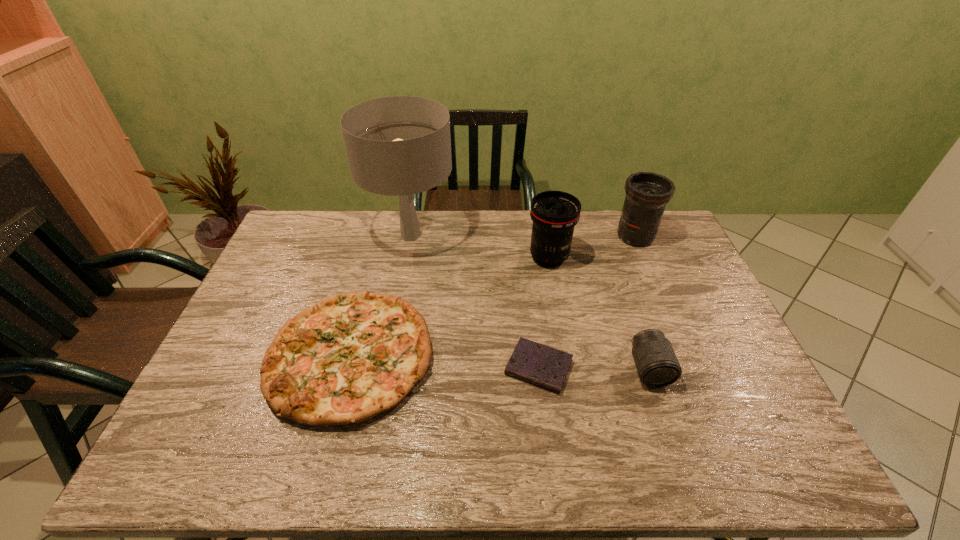
Where is `vacant area between the diary and the lampshade`? This screenshot has width=960, height=540. vacant area between the diary and the lampshade is located at coordinates (475, 301).

The width and height of the screenshot is (960, 540). Identify the location of free space between the leftmost telephoto lens and the lampshade. (480, 246).

At what (x,y) coordinates should I click in order to perform the action: click on vacant space that's between the nearest telephoto lens and the leftmost telephoto lens. Please return your answer as a coordinate pair (x, y). Looking at the image, I should click on (599, 313).

Where is `vacant region between the diary and the leftmost telephoto lens`? Image resolution: width=960 pixels, height=540 pixels. vacant region between the diary and the leftmost telephoto lens is located at coordinates (543, 313).

The width and height of the screenshot is (960, 540). Find the location of `vacant region between the leftmost telephoto lens and the nearest telephoto lens`. vacant region between the leftmost telephoto lens and the nearest telephoto lens is located at coordinates (599, 313).

Locate an element on the screen. empty space that is in between the nearest telephoto lens and the leftmost telephoto lens is located at coordinates (599, 313).

Locate an element on the screen. This screenshot has height=540, width=960. free space between the diary and the leftmost telephoto lens is located at coordinates (543, 313).

Select which object appears as the third closest to the tallest object. Please provide its 2D coordinates. Your answer should be formatted as a tuple, i.e. [(x, y)], where the tuple contains the x and y coordinates of a point satisfying the conditions above.

[(538, 364)]

Select which object appears as the closest to the leftmost telephoto lens. Please provide its 2D coordinates. Your answer should be formatted as a tuple, i.e. [(x, y)], where the tuple contains the x and y coordinates of a point satisfying the conditions above.

[(647, 193)]

Identify the location of telephoto lens that stands as the second closest to the tallest object. (647, 193).